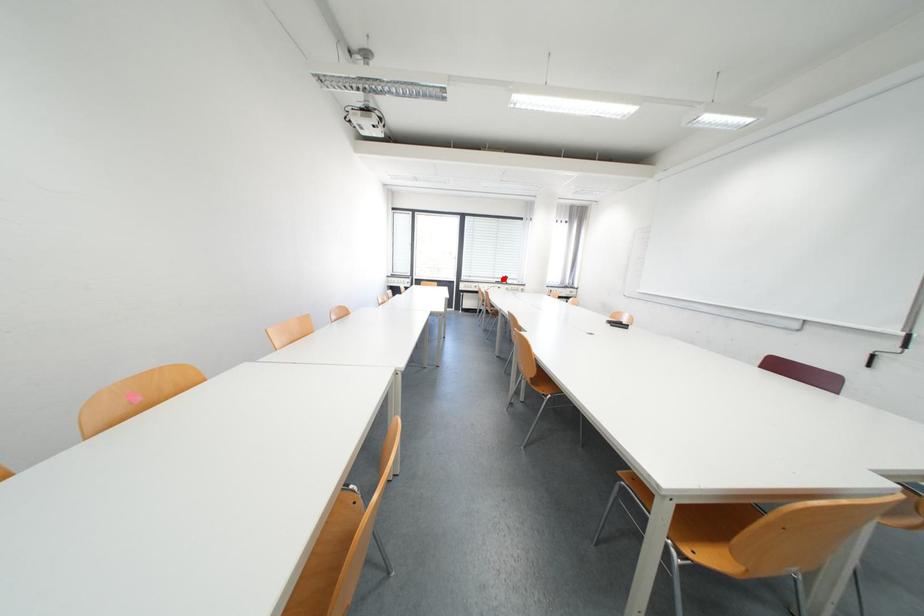
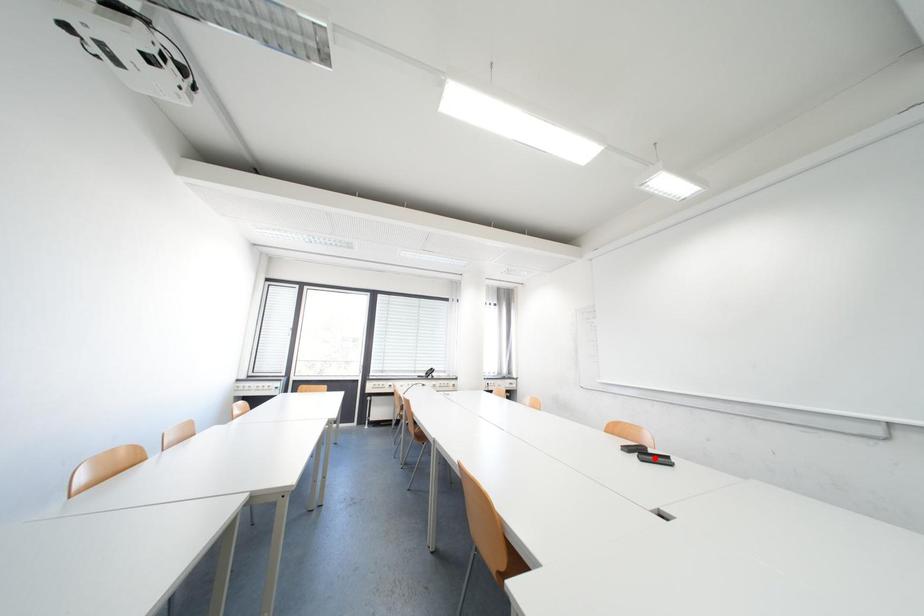
I am providing you with two images of the same scene from different viewpoints. A red point is marked on the first image and another point is marked on the second image. Does the point marked in image1 correspond to the same location as the one in image2?

No